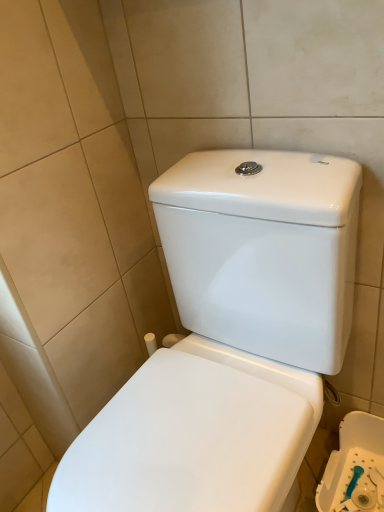
Question: From the image's perspective, is white glossy toilet at center under white glossy toilet at lower right?

Choices:
 (A) no
 (B) yes

Answer: (A)

Question: From a real-world perspective, is white glossy toilet at center physically below white glossy toilet at lower right?

Choices:
 (A) no
 (B) yes

Answer: (A)

Question: Considering the relative positions of white glossy toilet at center and white glossy toilet at lower right in the image provided, is white glossy toilet at center to the right of white glossy toilet at lower right from the viewer's perspective?

Choices:
 (A) yes
 (B) no

Answer: (B)

Question: Is white glossy toilet at center further to camera compared to white glossy toilet at lower right?

Choices:
 (A) yes
 (B) no

Answer: (B)

Question: Is white glossy toilet at lower right completely or partially inside white glossy toilet at center?

Choices:
 (A) no
 (B) yes

Answer: (A)

Question: Considering the relative sizes of white glossy toilet at center and white glossy toilet at lower right in the image provided, is white glossy toilet at center smaller than white glossy toilet at lower right?

Choices:
 (A) no
 (B) yes

Answer: (A)

Question: Is white glossy toilet at lower right positioned with its back to white glossy toilet at center?

Choices:
 (A) yes
 (B) no

Answer: (B)

Question: Considering the relative positions of white glossy toilet at lower right and white glossy toilet at center in the image provided, is white glossy toilet at lower right to the right of white glossy toilet at center from the viewer's perspective?

Choices:
 (A) yes
 (B) no

Answer: (A)

Question: Is white glossy toilet at lower right shorter than white glossy toilet at center?

Choices:
 (A) no
 (B) yes

Answer: (B)

Question: Is white glossy toilet at lower right facing towards white glossy toilet at center?

Choices:
 (A) no
 (B) yes

Answer: (A)

Question: Is white glossy toilet at lower right not near white glossy toilet at center?

Choices:
 (A) no
 (B) yes

Answer: (A)

Question: From the image's perspective, is white glossy toilet at lower right under white glossy toilet at center?

Choices:
 (A) no
 (B) yes

Answer: (B)

Question: From the image's perspective, is white glossy toilet at center above or below white glossy toilet at lower right?

Choices:
 (A) above
 (B) below

Answer: (A)